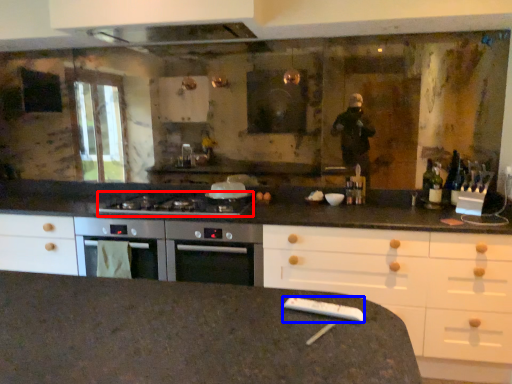
Question: Among these objects, which one is farthest to the camera, gas stove (highlighted by a red box) or appliance (highlighted by a blue box)?

Choices:
 (A) gas stove
 (B) appliance

Answer: (A)